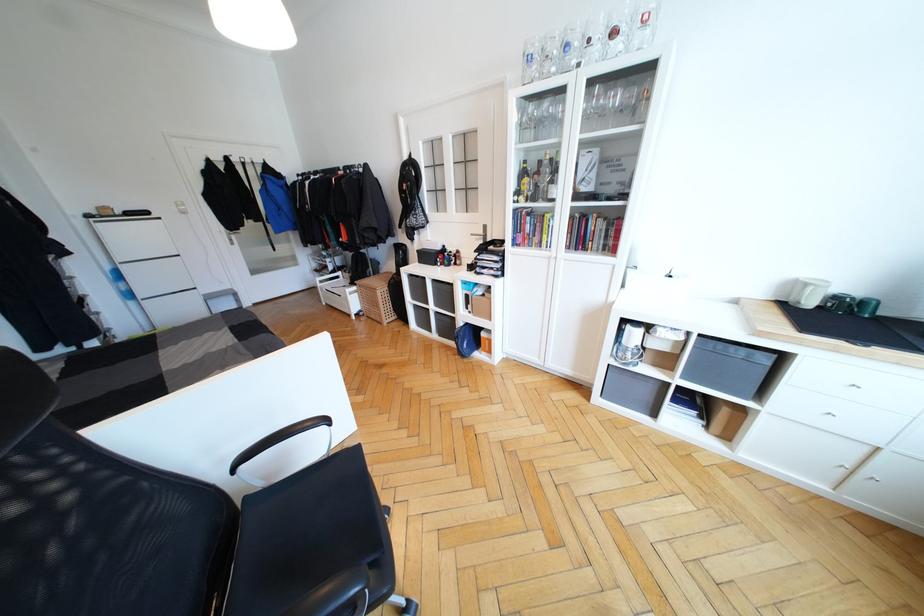
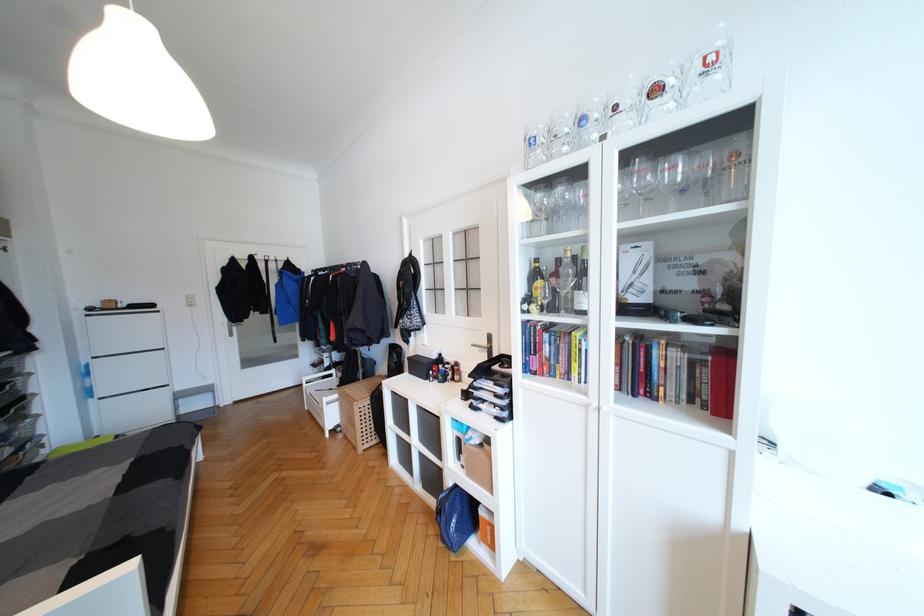
In the second image, find the point that corresponds to (x=484, y=233) in the first image.

(488, 344)